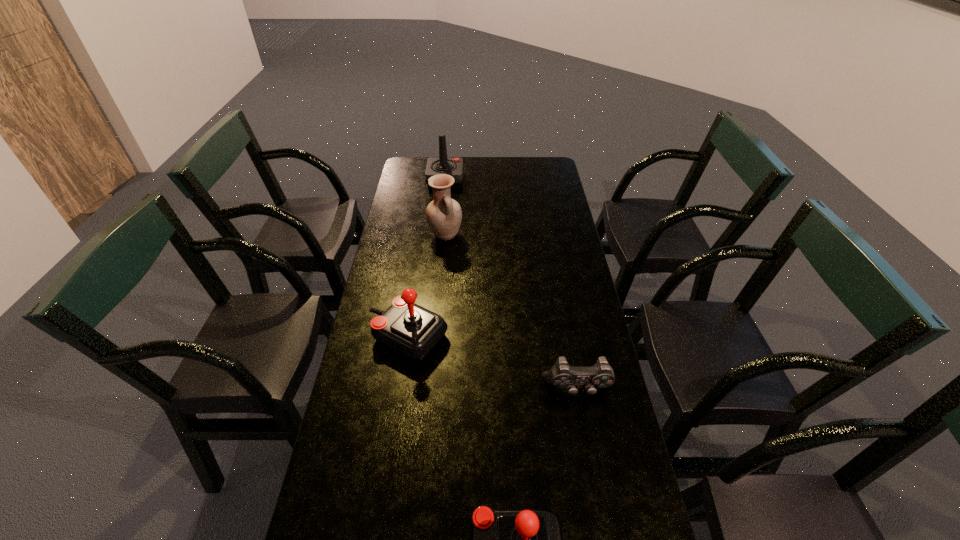
This screenshot has height=540, width=960. Find the location of `pottery that is at the left edge`. pottery that is at the left edge is located at coordinates (444, 215).

Locate an element on the screen. object present at the right edge is located at coordinates (562, 375).

Image resolution: width=960 pixels, height=540 pixels. In order to click on object positioned at the far left corner in this screenshot , I will do `click(453, 166)`.

In the image, there is a desktop. Find the location of `free space at the far edge`. free space at the far edge is located at coordinates (485, 174).

Image resolution: width=960 pixels, height=540 pixels. In order to click on blank space at the left edge of the desktop in this screenshot , I will do `click(355, 402)`.

The image size is (960, 540). In order to click on free region at the right edge of the desktop in this screenshot , I will do `click(583, 330)`.

At what (x,y) coordinates should I click in order to perform the action: click on empty location between the second farthest joystick and the control. Please return your answer as a coordinate pair (x, y). The image size is (960, 540). Looking at the image, I should click on (492, 363).

Image resolution: width=960 pixels, height=540 pixels. In order to click on vacant space that's between the pottery and the third farthest object in this screenshot , I will do `click(426, 286)`.

Find the location of a particular element. empty space that is in between the shortest object and the pottery is located at coordinates (512, 312).

Locate an element on the screen. The image size is (960, 540). free space between the fourth farthest object and the farthest object is located at coordinates (512, 285).